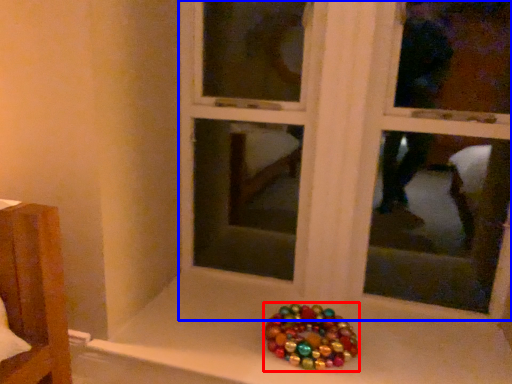
Question: Which point is further to the camera, glass bead (highlighted by a red box) or bay window (highlighted by a blue box)?

Choices:
 (A) glass bead
 (B) bay window

Answer: (A)